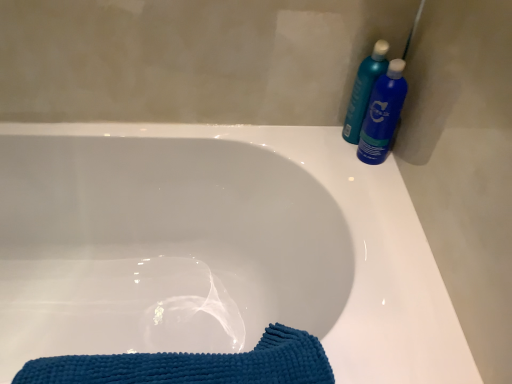
Question: Is white glossy bathtub at center to the left or to the right of blue glossy bottle at upper right, which ranks as the 1th cleaning product in right-to-left order, in the image?

Choices:
 (A) right
 (B) left

Answer: (B)

Question: Looking at their shapes, would you say white glossy bathtub at center is wider or thinner than blue glossy bottle at upper right, arranged as the second cleaning product when viewed from the left?

Choices:
 (A) wide
 (B) thin

Answer: (A)

Question: Estimate the real-world distances between objects in this image. Which object is closer to the blue textured towel at lower left?

Choices:
 (A) blue glossy bottle at upper right, which ranks as the 1th cleaning product in right-to-left order
 (B) teal plastic bottles at upper right, which is the first cleaning product in left-to-right order
 (C) white glossy bathtub at center

Answer: (C)

Question: Which object is positioned closest to the teal plastic bottles at upper right, which is the first cleaning product in left-to-right order?

Choices:
 (A) blue textured towel at lower left
 (B) blue glossy bottle at upper right, which ranks as the 1th cleaning product in right-to-left order
 (C) white glossy bathtub at center

Answer: (B)